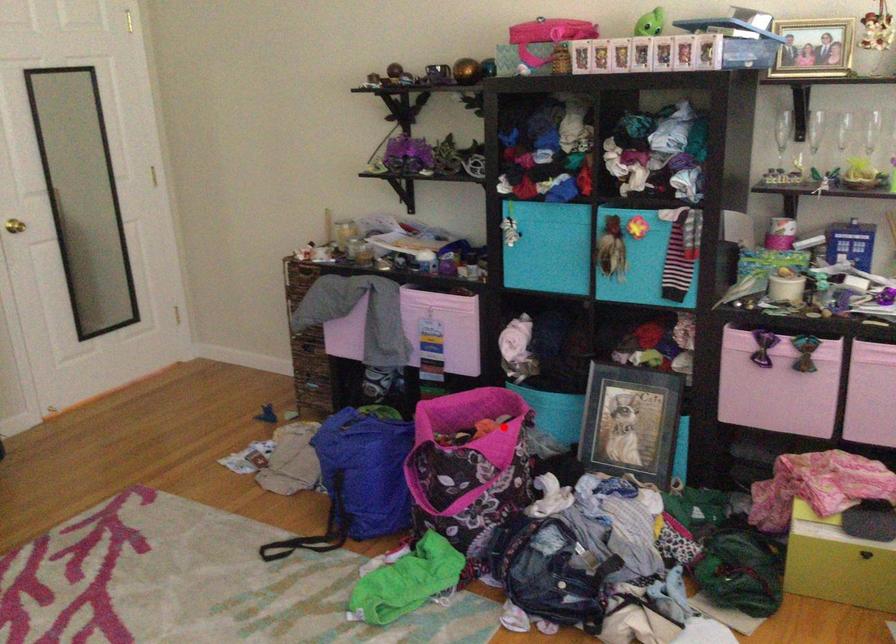
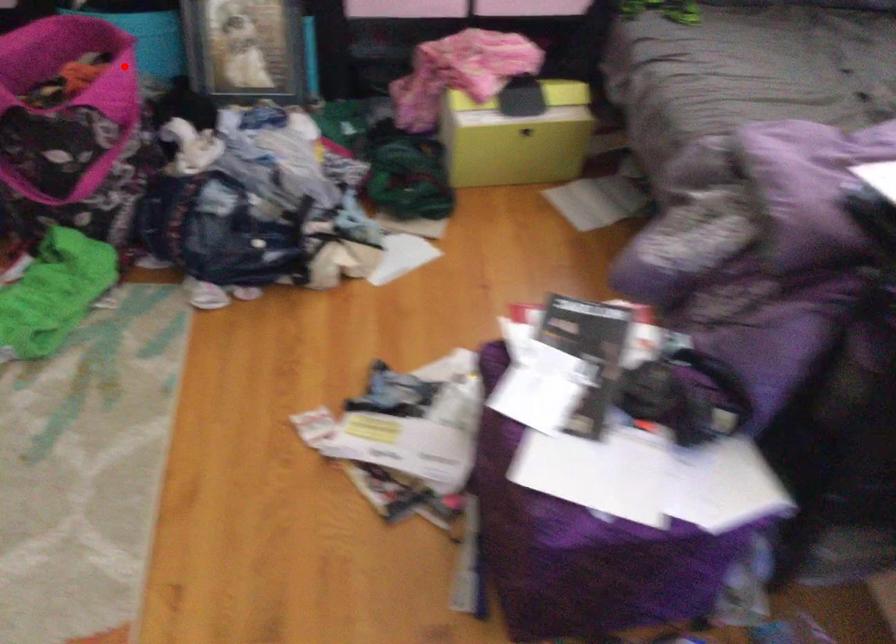
I am providing you with two images of the same scene from different viewpoints. A red point is marked on the first image and another point is marked on the second image. Are the points marked in image1 and image2 representing the same 3D position?

Yes